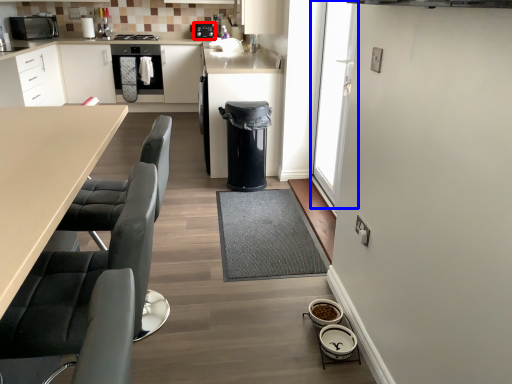
Question: Which of the following is the farthest to the observer, appliance (highlighted by a red box) or glass door (highlighted by a blue box)?

Choices:
 (A) appliance
 (B) glass door

Answer: (A)